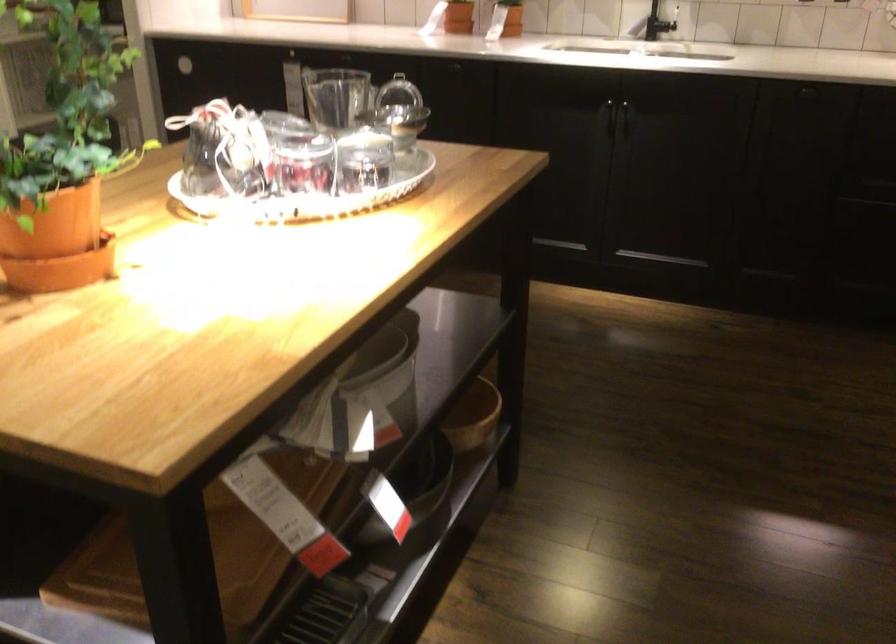
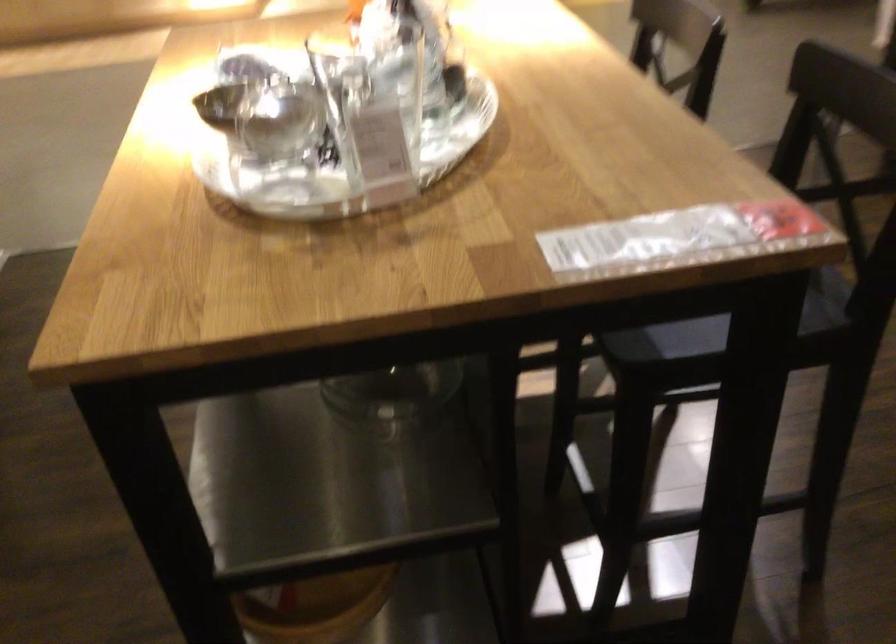
The point at (228, 124) is marked in the first image. Where is the corresponding point in the second image?

(371, 29)